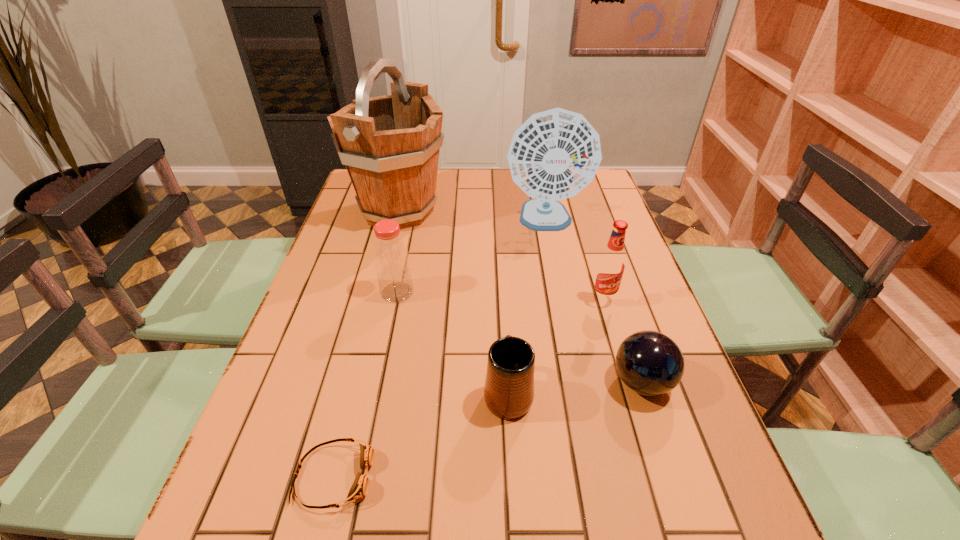
Locate an element on the screen. This screenshot has height=540, width=960. vacant space in between the root beer and the tallest object is located at coordinates (500, 255).

Where is `object that is the sixth closest to the bucket`? Image resolution: width=960 pixels, height=540 pixels. object that is the sixth closest to the bucket is located at coordinates (359, 489).

This screenshot has height=540, width=960. I want to click on object that stands as the closest to the bottle, so click(390, 144).

Locate an element on the screen. This screenshot has height=540, width=960. vacant space that satisfies the following two spatial constraints: 1. on the grille of the fan; 2. with the lenses facing forward on the shortest object is located at coordinates (597, 476).